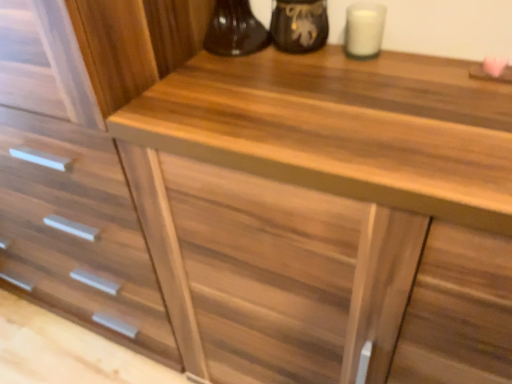
Question: Considering the positions of wooden drawer at center and white matte candle at upper right in the image, is wooden drawer at center bigger or smaller than white matte candle at upper right?

Choices:
 (A) big
 (B) small

Answer: (A)

Question: Is wooden drawer at center to the left or to the right of white matte candle at upper right in the image?

Choices:
 (A) left
 (B) right

Answer: (A)

Question: Estimate the real-world distances between objects in this image. Which object is farther from the white matte candle at upper right?

Choices:
 (A) matte black vase at upper center
 (B) wooden drawer at center

Answer: (B)

Question: Considering the real-world distances, which object is farthest from the white matte candle at upper right?

Choices:
 (A) matte black vase at upper center
 (B) wooden drawer at center

Answer: (B)